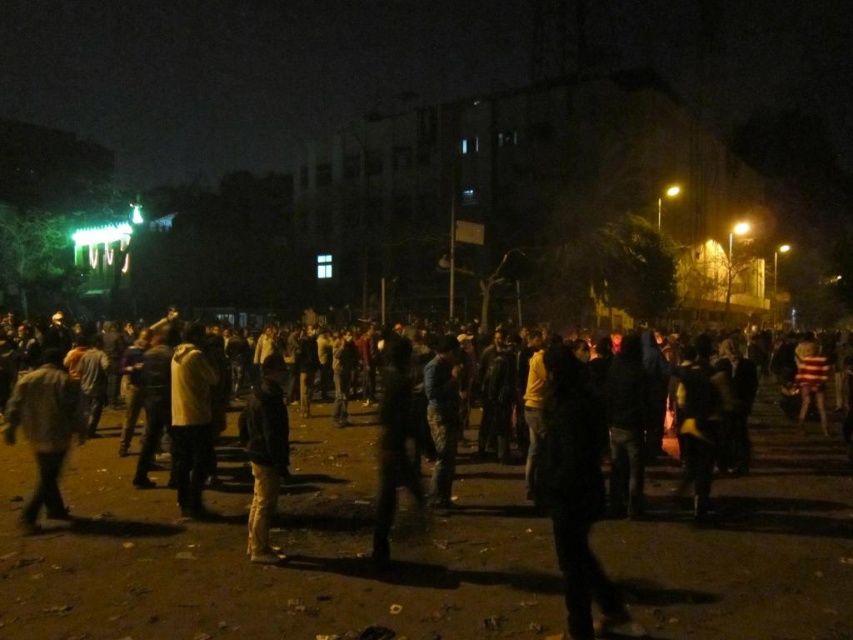
Question: Is dark matte jacket at center smaller than yellow matte jacket at center?

Choices:
 (A) no
 (B) yes

Answer: (B)

Question: Can you confirm if dark gray jacket at lower left is bigger than yellow matte jacket at center?

Choices:
 (A) no
 (B) yes

Answer: (A)

Question: Can you confirm if dark gray jacket at lower left is thinner than dark gray jacket at center?

Choices:
 (A) no
 (B) yes

Answer: (A)

Question: Which of the following is the farthest from the observer?

Choices:
 (A) (67, 387)
 (B) (183, 387)
 (C) (614, 627)

Answer: (B)

Question: Which point is farther to the camera?

Choices:
 (A) (256, 545)
 (B) (601, 445)
 (C) (25, 513)
 (D) (184, 374)

Answer: (D)

Question: Estimate the real-world distances between objects in this image. Which object is farther from the dark gray jacket at center?

Choices:
 (A) dark gray jacket at lower left
 (B) yellow matte jacket at center

Answer: (A)